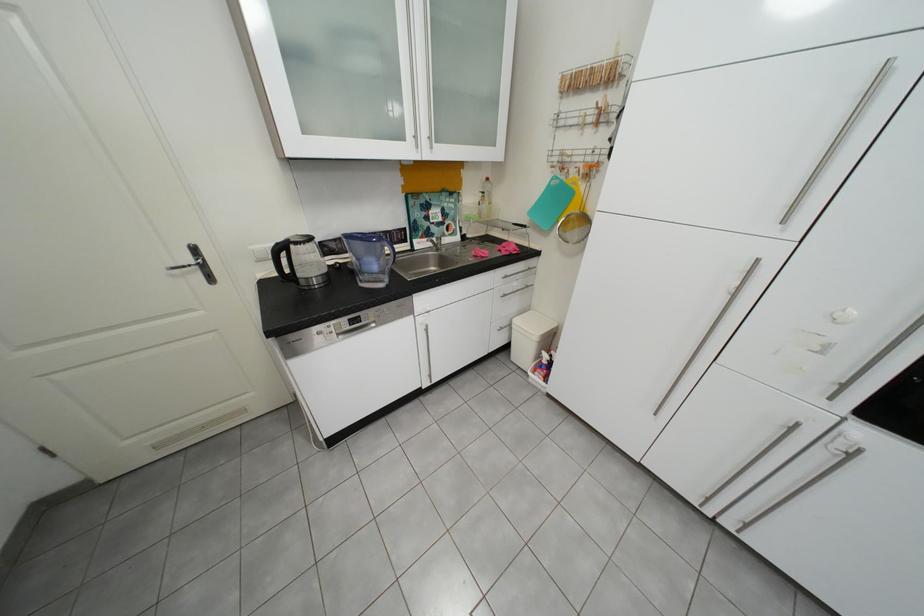
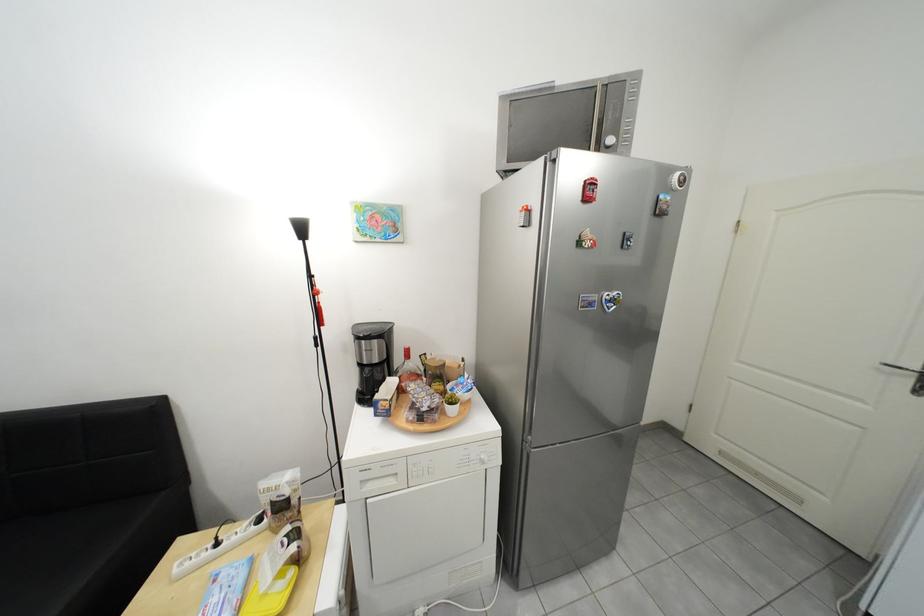
First-person continuous shooting, in which direction is the camera rotating?

The camera rotated toward left-down.